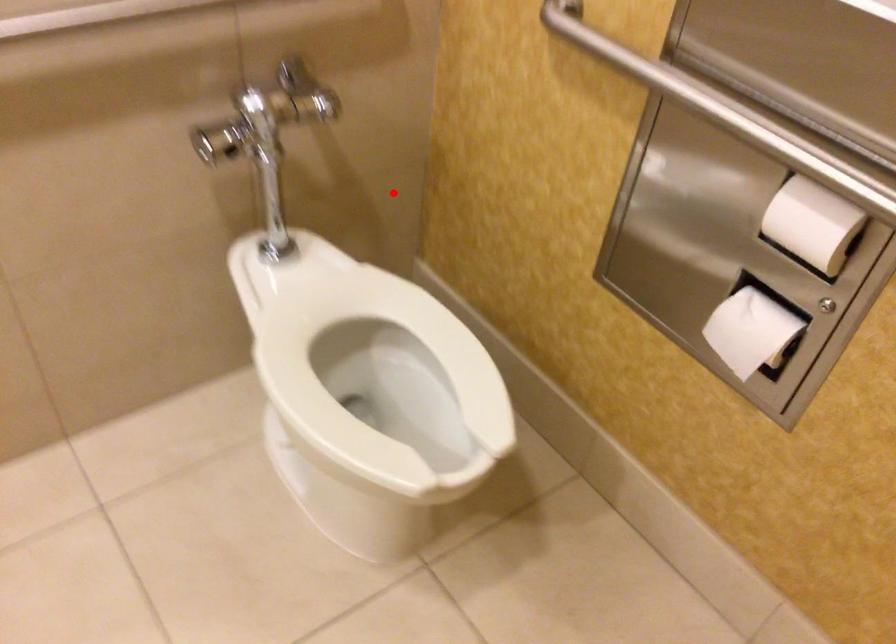
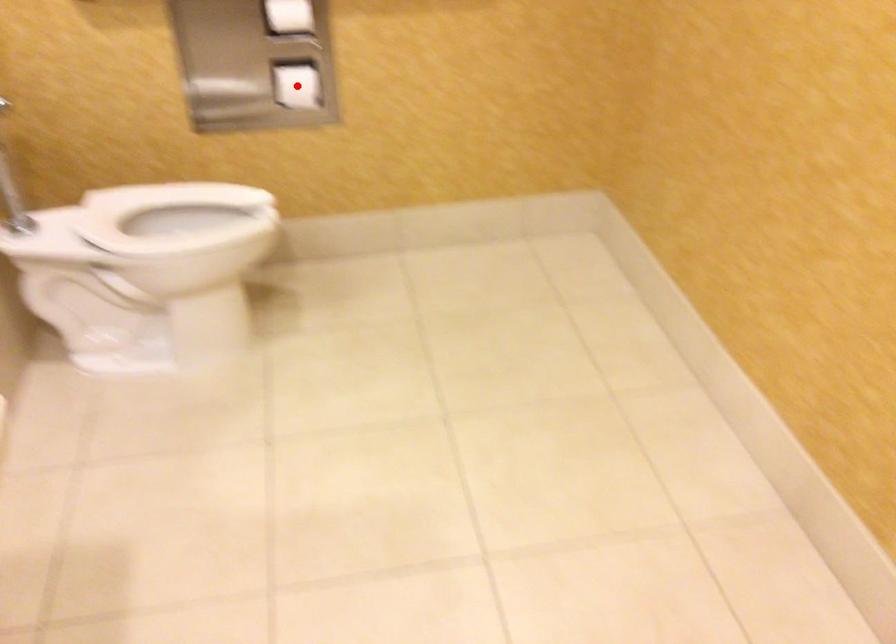
I am providing you with two images of the same scene from different viewpoints. A red point is marked on the first image and another point is marked on the second image. Is the marked point in image1 the same physical position as the marked point in image2?

No